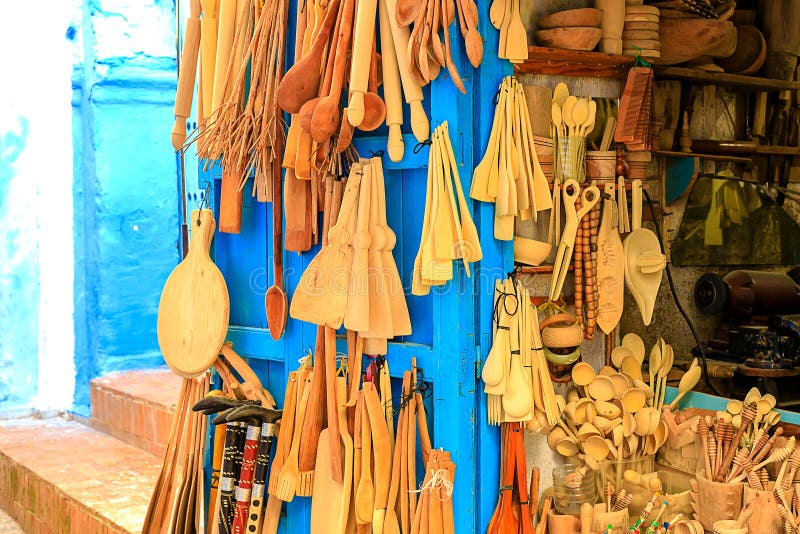
The image size is (800, 534). Identify the location of blue door. (440, 323).